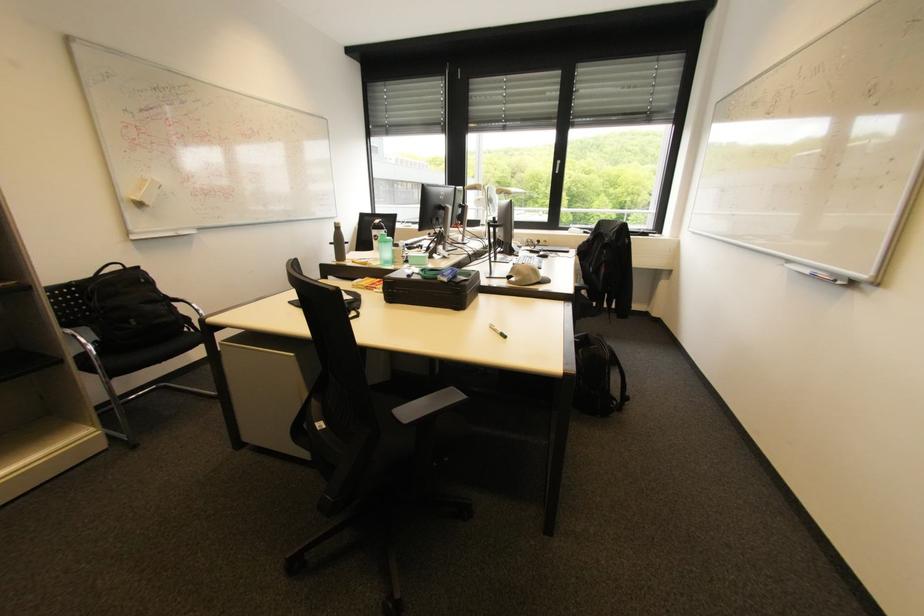
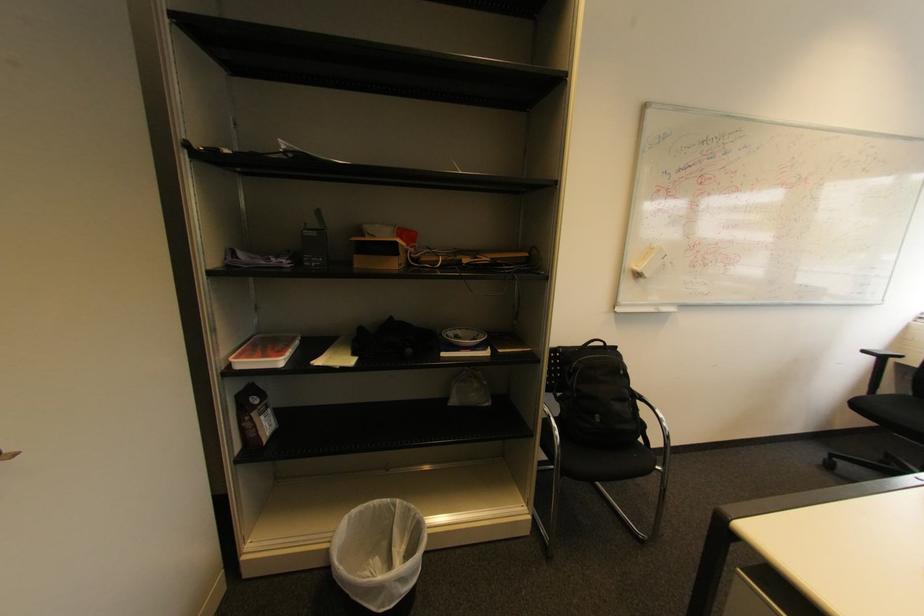
Find the pixel in the second image that matches pixel 195 395 in the first image.

(611, 506)